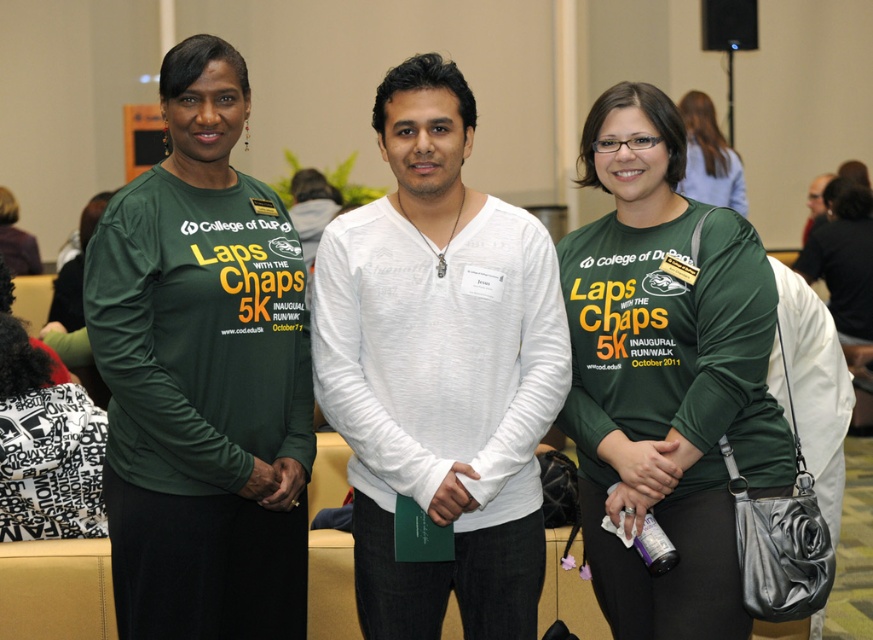
Can you confirm if white soft shirt at center is positioned to the left of white matte paper at center?

Correct, you'll find white soft shirt at center to the left of white matte paper at center.

Does white soft shirt at center have a larger size compared to white matte paper at center?

Yes.

Does point (450, 326) come behind point (452, 476)?

Yes, it is behind point (452, 476).

Find the location of a particular element. This screenshot has width=873, height=640. white soft shirt at center is located at coordinates (438, 371).

Does green matte long-sleeve shirt at left appear under white matte paper at center?

Incorrect, green matte long-sleeve shirt at left is not positioned below white matte paper at center.

The width and height of the screenshot is (873, 640). Describe the element at coordinates (203, 376) in the screenshot. I see `green matte long-sleeve shirt at left` at that location.

Where is `green matte long-sleeve shirt at left`? green matte long-sleeve shirt at left is located at coordinates (203, 376).

The height and width of the screenshot is (640, 873). I want to click on green matte long-sleeve shirt at left, so click(x=203, y=376).

Does matte green shirt at center lie in front of white matte paper at center?

No, matte green shirt at center is further to the viewer.

Is point (689, 161) more distant than point (434, 522)?

Yes, it is behind point (434, 522).

Find the location of a particular element. This screenshot has height=640, width=873. matte green shirt at center is located at coordinates (709, 157).